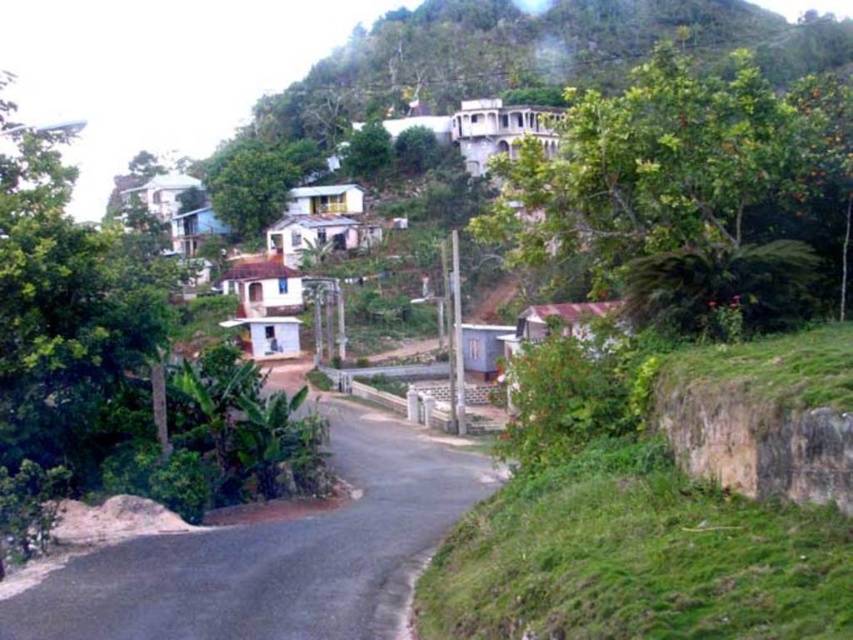
Question: Which is farther from the green leafy tree at center?

Choices:
 (A) green leafy tree at upper right
 (B) asphalt road at center

Answer: (B)

Question: Which object is positioned closest to the green leafy tree at center?

Choices:
 (A) green leafy tree at left
 (B) green leafy tree at upper right
 (C) asphalt road at center

Answer: (A)

Question: Can you confirm if asphalt road at center is smaller than green leafy tree at center?

Choices:
 (A) no
 (B) yes

Answer: (B)

Question: Is green leafy tree at left to the right of green leafy tree at upper right from the viewer's perspective?

Choices:
 (A) no
 (B) yes

Answer: (A)

Question: Which point is closer to the camera?

Choices:
 (A) (721, 244)
 (B) (161, 552)

Answer: (B)

Question: Observing the image, what is the correct spatial positioning of green leafy tree at upper right in reference to green leafy tree at center?

Choices:
 (A) right
 (B) left

Answer: (A)